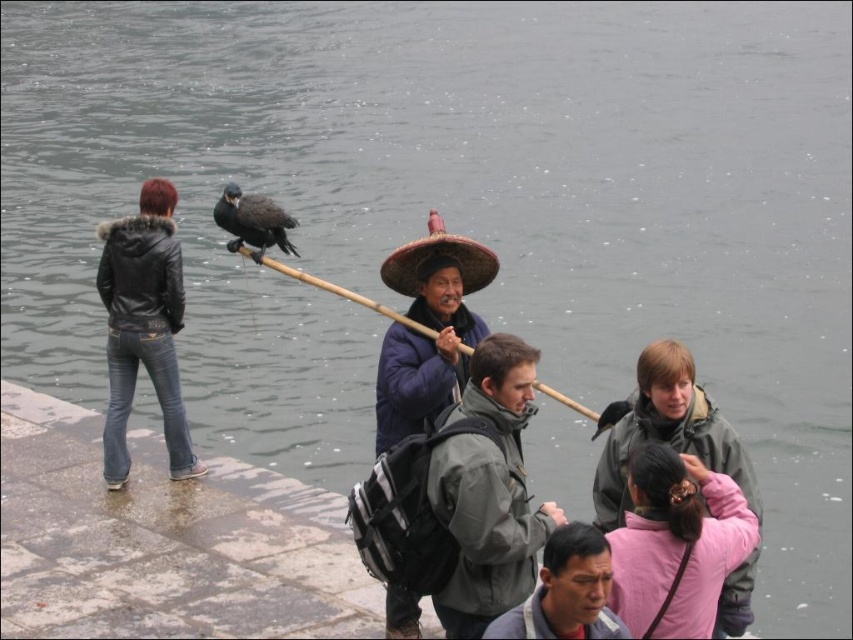
You are a photographer trying to capture a clear shot of the gray fabric jacket at lower center. However, the black leather jacket at left is blocking your view. Can you move around to the right side to get an unobstructed view?

The black leather jacket at left is positioned over gray fabric jacket at lower center, so moving to the right side might not help as the black leather jacket is still in front. You might need to move to the left side instead to get an unobstructed view.

You are a photographer wanting to capture the pink fabric hairband at lower right and the gray fabric jacket at lower center in the same frame. Which object should you focus on first to ensure both are in the frame?

The pink fabric hairband at lower right has a greater height compared to the gray fabric jacket at lower center, so you should focus on the pink fabric hairband at lower right first to ensure both are in the frame.